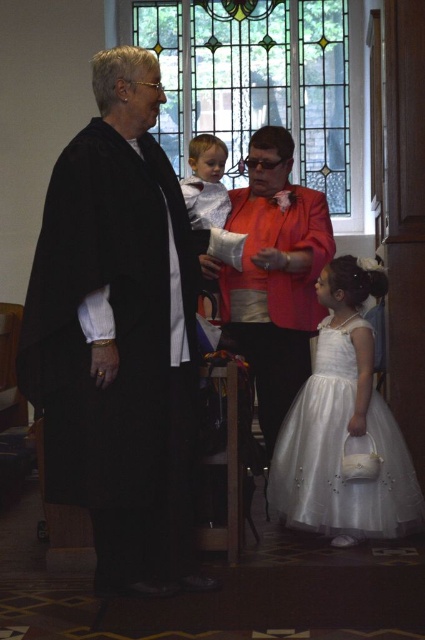
You are a photographer setting up equipment in the church. You need to position a camera that has a 5 meter focal length to capture both the white tulle dress at lower right and the matte red jacket at center without moving the camera. Is this possible?

The white tulle dress at lower right and the matte red jacket at center are 5.41 meters apart. Since the camera has a 5 meter focal length, it cannot capture both objects in the same frame as the distance between them exceeds the camera range.

You are standing in the church and want to take a photo of the white tulle dress at lower right using a camera. Can you do this without moving closer than 25 meters?

The white tulle dress at lower right and the camera are 27.10 meters apart, so yes, you can take the photo without moving closer than 25 meters since the distance is sufficient.

You are an interior designer assessing the space. You need to determine if the stained glass window at upper center can accommodate a decorative frame that requires the width of the white tulle dress at lower right. Can the frame fit based on their widths?

The stained glass window at upper center might be wider than the white tulle dress at lower right, so the frame could potentially fit if the window is indeed wider. However, exact measurements are needed for confirmation.